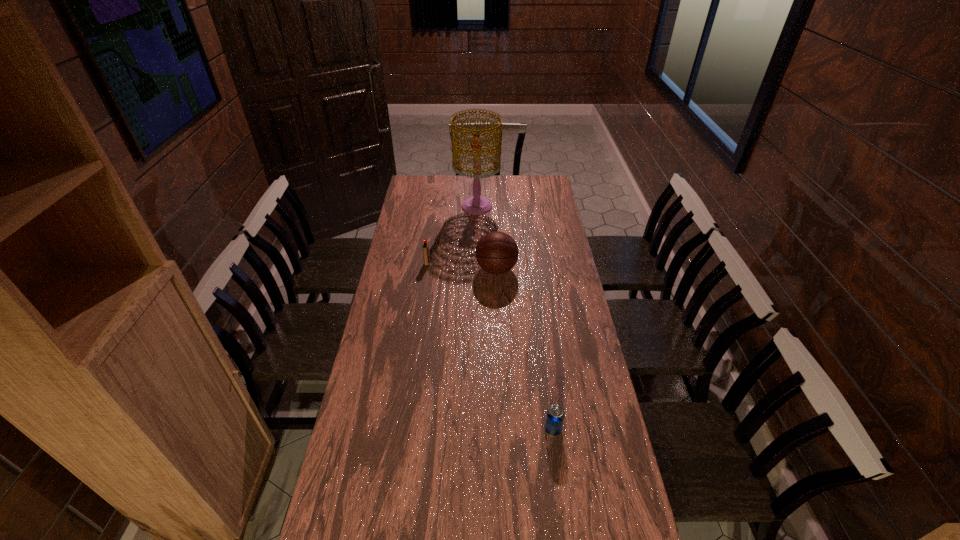
At what (x,y) coordinates should I click in order to perform the action: click on vacant area that lies between the third shortest object and the shortest object. Please return your answer as a coordinate pair (x, y). The image size is (960, 540). Looking at the image, I should click on (525, 349).

This screenshot has width=960, height=540. Identify the location of vacant area between the tallest object and the leftmost object. (452, 235).

I want to click on blank region between the lampshade and the shortest object, so click(515, 318).

You are a GUI agent. You are given a task and a screenshot of the screen. Output one action in this format:
    pyautogui.click(x=<x>, y=<y>)
    Task: Click on the free space between the nearest object and the third tallest object
    
    Given the screenshot: What is the action you would take?
    pyautogui.click(x=490, y=346)

This screenshot has width=960, height=540. I want to click on vacant space that's between the beer can and the second shortest object, so click(x=490, y=346).

Locate an element on the screen. The image size is (960, 540). free space between the leftmost object and the second tallest object is located at coordinates (462, 266).

Identify which object is the second nearest to the igniter. Please provide its 2D coordinates. Your answer should be formatted as a tuple, i.e. [(x, y)], where the tuple contains the x and y coordinates of a point satisfying the conditions above.

[(476, 205)]

Find the location of a particular element. The image size is (960, 540). the third closest object to the shortest object is located at coordinates (476, 205).

Where is `free space that satisfies the following two spatial constraints: 1. on the front side of the lampshade; 2. on the right side of the rightmost object`? This screenshot has height=540, width=960. free space that satisfies the following two spatial constraints: 1. on the front side of the lampshade; 2. on the right side of the rightmost object is located at coordinates (474, 429).

Where is `free point that satisfies the following two spatial constraints: 1. on the back side of the third tallest object; 2. on the left side of the tallest object`? This screenshot has height=540, width=960. free point that satisfies the following two spatial constraints: 1. on the back side of the third tallest object; 2. on the left side of the tallest object is located at coordinates (435, 207).